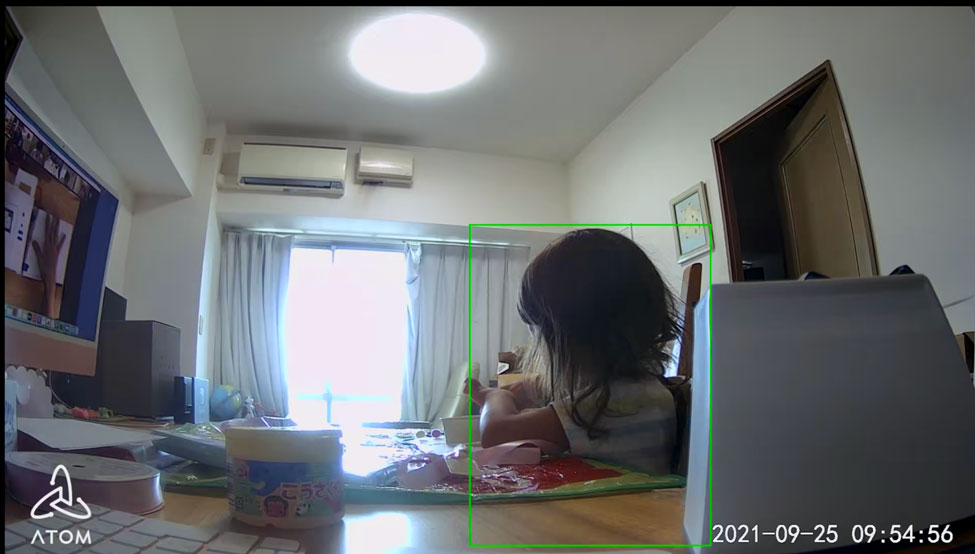
At what (x,y) coordinates should I click in order to perform the action: click on door. Please return your answer as a coordinate pair (x, y). Looking at the image, I should click on (812, 225).